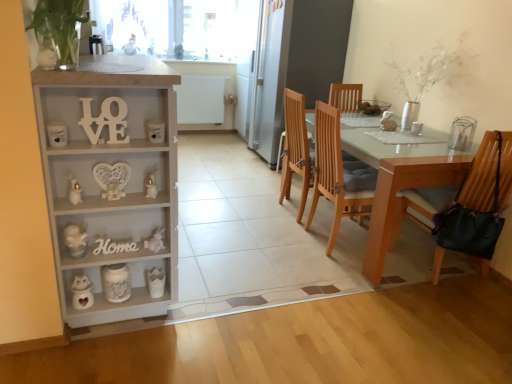
Question: Should I look upward or downward to see white wood cabinet at left?

Choices:
 (A) up
 (B) down

Answer: (A)

Question: Should I look upward or downward to see white wood love at left, which appears as the 2th number when ordered from the bottom?

Choices:
 (A) up
 (B) down

Answer: (A)

Question: From a real-world perspective, does white wood love at left, which is the first number from top to bottom, sit lower than transparent glass window screen at upper center?

Choices:
 (A) yes
 (B) no

Answer: (A)

Question: Considering the relative positions of white wood love at left, the second number viewed from the back, and transparent glass window screen at upper center in the image provided, is white wood love at left, the second number viewed from the back, behind transparent glass window screen at upper center?

Choices:
 (A) no
 (B) yes

Answer: (A)

Question: Can you confirm if white wood love at left, which is the first number from top to bottom, is positioned to the right of transparent glass window screen at upper center?

Choices:
 (A) yes
 (B) no

Answer: (A)

Question: Does white wood love at left, the second number viewed from the back, have a lesser height compared to transparent glass window screen at upper center?

Choices:
 (A) yes
 (B) no

Answer: (A)

Question: Does white wood love at left, the second number viewed from the back, appear on the left side of transparent glass window screen at upper center?

Choices:
 (A) no
 (B) yes

Answer: (A)

Question: From the image's perspective, does white wood love at left, which ranks as the first number in front-to-back order, appear lower than transparent glass window screen at upper center?

Choices:
 (A) no
 (B) yes

Answer: (B)

Question: Is the position of leather-like black bag at right, which ranks as the 1th chair in right-to-left order, more distant than that of transparent glass window screen at upper center?

Choices:
 (A) yes
 (B) no

Answer: (B)

Question: From the image's perspective, is leather-like black bag at right, which is counted as the 2th chair, starting from the back, under transparent glass window screen at upper center?

Choices:
 (A) yes
 (B) no

Answer: (A)

Question: From a real-world perspective, is leather-like black bag at right, the 2th chair in the left-to-right sequence, beneath transparent glass window screen at upper center?

Choices:
 (A) no
 (B) yes

Answer: (B)

Question: Considering the relative sizes of leather-like black bag at right, the 2th chair in the left-to-right sequence, and transparent glass window screen at upper center in the image provided, is leather-like black bag at right, the 2th chair in the left-to-right sequence, smaller than transparent glass window screen at upper center?

Choices:
 (A) yes
 (B) no

Answer: (B)

Question: From the image's perspective, is leather-like black bag at right, the first chair viewed from the front, on transparent glass window screen at upper center?

Choices:
 (A) yes
 (B) no

Answer: (B)

Question: Considering the relative sizes of leather-like black bag at right, the first chair viewed from the front, and transparent glass window screen at upper center in the image provided, is leather-like black bag at right, the first chair viewed from the front, bigger than transparent glass window screen at upper center?

Choices:
 (A) no
 (B) yes

Answer: (B)

Question: Does transparent glass window screen at upper center have a larger size compared to white wood love at left, the second number viewed from the back?

Choices:
 (A) no
 (B) yes

Answer: (B)